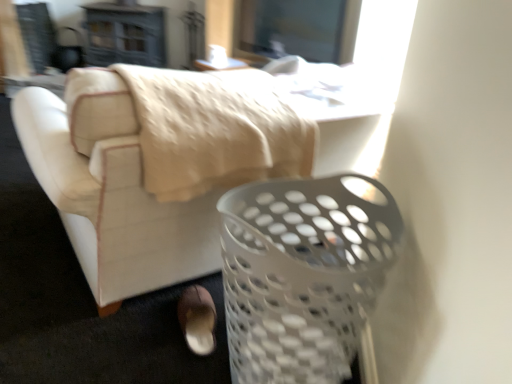
Question: Can you confirm if white plastic table at upper center is bigger than white plastic laundry basket at lower right?

Choices:
 (A) no
 (B) yes

Answer: (A)

Question: Is white plastic table at upper center far from white plastic laundry basket at lower right?

Choices:
 (A) yes
 (B) no

Answer: (A)

Question: Can you confirm if white plastic table at upper center is smaller than white plastic laundry basket at lower right?

Choices:
 (A) yes
 (B) no

Answer: (A)

Question: Does white plastic table at upper center come behind white plastic laundry basket at lower right?

Choices:
 (A) yes
 (B) no

Answer: (A)

Question: Can you confirm if white plastic table at upper center is thinner than white plastic laundry basket at lower right?

Choices:
 (A) no
 (B) yes

Answer: (B)

Question: From a real-world perspective, is white plastic laundry basket at lower right positioned above or below white plastic basket at lower right?

Choices:
 (A) below
 (B) above

Answer: (B)

Question: Considering the positions of white plastic laundry basket at lower right and white plastic basket at lower right in the image, is white plastic laundry basket at lower right taller or shorter than white plastic basket at lower right?

Choices:
 (A) short
 (B) tall

Answer: (A)

Question: Is white plastic laundry basket at lower right spatially inside white plastic basket at lower right, or outside of it?

Choices:
 (A) inside
 (B) outside

Answer: (B)

Question: Considering the positions of white plastic laundry basket at lower right and white plastic basket at lower right in the image, is white plastic laundry basket at lower right bigger or smaller than white plastic basket at lower right?

Choices:
 (A) small
 (B) big

Answer: (B)

Question: From their relative heights in the image, would you say white plastic table at upper center is taller or shorter than white plastic basket at lower right?

Choices:
 (A) tall
 (B) short

Answer: (B)

Question: Considering the positions of white plastic table at upper center and white plastic basket at lower right in the image, is white plastic table at upper center wider or thinner than white plastic basket at lower right?

Choices:
 (A) thin
 (B) wide

Answer: (A)

Question: Choose the correct answer: Is white plastic table at upper center inside white plastic basket at lower right or outside it?

Choices:
 (A) inside
 (B) outside

Answer: (B)

Question: Looking at the image, does white plastic table at upper center seem bigger or smaller compared to white plastic basket at lower right?

Choices:
 (A) small
 (B) big

Answer: (A)

Question: Relative to brown suede shoe at lower center, is white plastic laundry basket at lower right in front or behind?

Choices:
 (A) behind
 (B) front

Answer: (B)

Question: Considering the positions of white plastic laundry basket at lower right and brown suede shoe at lower center in the image, is white plastic laundry basket at lower right wider or thinner than brown suede shoe at lower center?

Choices:
 (A) thin
 (B) wide

Answer: (B)